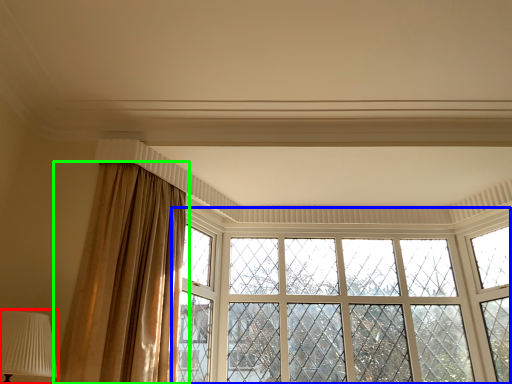
Question: Based on their relative distances, which object is nearer to table lamp (highlighted by a red box)? Choose from window (highlighted by a blue box) and curtain (highlighted by a green box).

Choices:
 (A) window
 (B) curtain

Answer: (B)